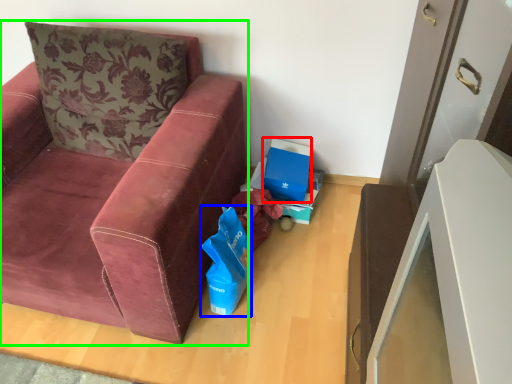
Question: Estimate the real-world distances between objects in this image. Which object is closer to cardboard box (highlighted by a red box), gift bag (highlighted by a blue box) or studio couch (highlighted by a green box)?

Choices:
 (A) gift bag
 (B) studio couch

Answer: (A)